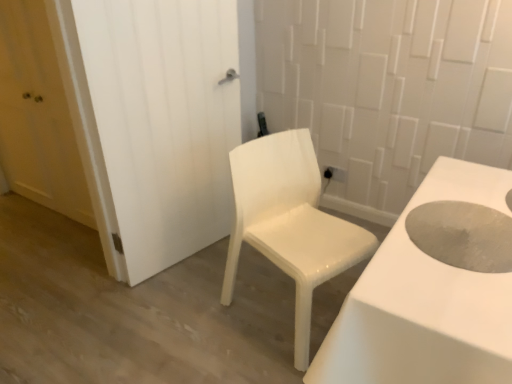
How much space does white matte door at center, marked as the second door in a left-to-right arrangement, occupy horizontally?

3.66 inches.

Image resolution: width=512 pixels, height=384 pixels. Find the location of `white glossy chair at center`. white glossy chair at center is located at coordinates click(289, 222).

Is the position of white glossy chair at center more distant than that of white matte door at center, which is the 1th door from right to left?

No, white glossy chair at center is closer to the camera.

Considering the points (320, 185) and (224, 17), which point is in front, point (320, 185) or point (224, 17)?

The point (224, 17) is closer.

How different are the orientations of white glossy chair at center and white matte door at center, marked as the second door in a left-to-right arrangement, in degrees?

The angular difference between white glossy chair at center and white matte door at center, marked as the second door in a left-to-right arrangement, is 1.38 degrees.

Which of these two, matte white door at left, which ranks as the 1th door in left-to-right order, or white matte door at center, marked as the second door in a left-to-right arrangement, is thinner?

matte white door at left, which ranks as the 1th door in left-to-right order.

Between matte white door at left, which ranks as the 2th door in right-to-left order, and white matte door at center, which is the 1th door from right to left, which one appears on the right side from the viewer's perspective?

white matte door at center, which is the 1th door from right to left.

From the picture: Considering the sizes of matte white door at left, which ranks as the 1th door in left-to-right order, and white matte door at center, which is the 1th door from right to left, in the image, is matte white door at left, which ranks as the 1th door in left-to-right order, taller or shorter than white matte door at center, which is the 1th door from right to left,?

Considering their sizes, matte white door at left, which ranks as the 1th door in left-to-right order, has less height than white matte door at center, which is the 1th door from right to left.

Considering the positions of objects matte white door at left, which ranks as the 1th door in left-to-right order, and white matte door at center, marked as the second door in a left-to-right arrangement, in the image provided, who is in front, matte white door at left, which ranks as the 1th door in left-to-right order, or white matte door at center, marked as the second door in a left-to-right arrangement,?

Positioned in front is white matte door at center, marked as the second door in a left-to-right arrangement.

Is gray matte hole at center right in contact with white matte door at center, which is the 1th door from right to left?

No.

Can you tell me how much gray matte hole at center right and white matte door at center, which is the 1th door from right to left, differ in facing direction?

There is a 164-degree angle between the facing directions of gray matte hole at center right and white matte door at center, which is the 1th door from right to left.

Can we say gray matte hole at center right lies outside white matte door at center, marked as the second door in a left-to-right arrangement?

Yes, gray matte hole at center right is located beyond the bounds of white matte door at center, marked as the second door in a left-to-right arrangement.

Which of these two, gray matte hole at center right or white matte door at center, which is the 1th door from right to left, stands shorter?

gray matte hole at center right.

Is matte white door at left, which ranks as the 2th door in right-to-left order, thinner than white glossy chair at center?

Yes.

Does matte white door at left, which ranks as the 1th door in left-to-right order, have a lesser height compared to white glossy chair at center?

In fact, matte white door at left, which ranks as the 1th door in left-to-right order, may be taller than white glossy chair at center.

Is matte white door at left, which ranks as the 2th door in right-to-left order, placed right next to white glossy chair at center?

matte white door at left, which ranks as the 2th door in right-to-left order, and white glossy chair at center are clearly separated.

From a real-world perspective, which is physically above, matte white door at left, which ranks as the 2th door in right-to-left order, or white glossy chair at center?

matte white door at left, which ranks as the 2th door in right-to-left order, is physically above.

Considering the points (429, 221) and (282, 182), which point is behind, point (429, 221) or point (282, 182)?

Positioned behind is point (282, 182).

Which object is positioned more to the left, gray matte hole at center right or white glossy chair at center?

white glossy chair at center is more to the left.

Between gray matte hole at center right and white glossy chair at center, which one has smaller size?

gray matte hole at center right.

Can you tell me how much gray matte hole at center right and white glossy chair at center differ in facing direction?

The facing directions of gray matte hole at center right and white glossy chair at center are 162 degrees apart.

Can you confirm if white matte door at center, marked as the second door in a left-to-right arrangement, is shorter than white glossy chair at center?

In fact, white matte door at center, marked as the second door in a left-to-right arrangement, may be taller than white glossy chair at center.

Can you confirm if white matte door at center, marked as the second door in a left-to-right arrangement, is wider than white glossy chair at center?

No.

Is white matte door at center, marked as the second door in a left-to-right arrangement, inside or outside of white glossy chair at center?

white matte door at center, marked as the second door in a left-to-right arrangement, lies outside white glossy chair at center.

Does white matte door at center, marked as the second door in a left-to-right arrangement, appear on the right side of white glossy chair at center?

Incorrect, white matte door at center, marked as the second door in a left-to-right arrangement, is not on the right side of white glossy chair at center.

From the image's perspective, is white matte door at center, marked as the second door in a left-to-right arrangement, located above or below matte white door at left, which ranks as the 2th door in right-to-left order?

Clearly, from the image's perspective, white matte door at center, marked as the second door in a left-to-right arrangement, is below matte white door at left, which ranks as the 2th door in right-to-left order.

Is white matte door at center, which is the 1th door from right to left, positioned beyond the bounds of matte white door at left, which ranks as the 2th door in right-to-left order?

Yes, white matte door at center, which is the 1th door from right to left, is located beyond the bounds of matte white door at left, which ranks as the 2th door in right-to-left order.

Considering the relative positions of white matte door at center, marked as the second door in a left-to-right arrangement, and matte white door at left, which ranks as the 2th door in right-to-left order, in the image provided, is white matte door at center, marked as the second door in a left-to-right arrangement, to the left or to the right of matte white door at left, which ranks as the 2th door in right-to-left order,?

Clearly, white matte door at center, marked as the second door in a left-to-right arrangement, is on the right of matte white door at left, which ranks as the 2th door in right-to-left order, in the image.

Where is `chair on the right of white matte door at center, which is the 1th door from right to left`? This screenshot has height=384, width=512. chair on the right of white matte door at center, which is the 1th door from right to left is located at coordinates (289, 222).

At what (x,y) coordinates should I click in order to perform the action: click on door that appears above the white matte door at center, marked as the second door in a left-to-right arrangement (from the image's perspective). Please return your answer as a coordinate pair (x, y). Looking at the image, I should click on (37, 115).

When comparing their distances from matte white door at left, which ranks as the 1th door in left-to-right order, does white matte door at center, which is the 1th door from right to left, or gray matte hole at center right seem closer?

white matte door at center, which is the 1th door from right to left, is closer to matte white door at left, which ranks as the 1th door in left-to-right order.

Based on their spatial positions, is white glossy chair at center or gray matte hole at center right closer to white matte door at center, which is the 1th door from right to left?

white glossy chair at center.

When comparing their distances from matte white door at left, which ranks as the 2th door in right-to-left order, does white glossy chair at center or white matte door at center, marked as the second door in a left-to-right arrangement, seem closer?

white matte door at center, marked as the second door in a left-to-right arrangement, is closer to matte white door at left, which ranks as the 2th door in right-to-left order.

From the image, which object appears to be farther from gray matte hole at center right, white glossy chair at center or matte white door at left, which ranks as the 1th door in left-to-right order?

The object further to gray matte hole at center right is matte white door at left, which ranks as the 1th door in left-to-right order.

Estimate the real-world distances between objects in this image. Which object is further from white matte door at center, marked as the second door in a left-to-right arrangement, matte white door at left, which ranks as the 1th door in left-to-right order, or white glossy chair at center?

matte white door at left, which ranks as the 1th door in left-to-right order, is positioned further to the anchor white matte door at center, marked as the second door in a left-to-right arrangement.

From the image, which object appears to be nearer to white matte door at center, marked as the second door in a left-to-right arrangement, matte white door at left, which ranks as the 1th door in left-to-right order, or gray matte hole at center right?

Among the two, matte white door at left, which ranks as the 1th door in left-to-right order, is located nearer to white matte door at center, marked as the second door in a left-to-right arrangement.

When comparing their distances from white glossy chair at center, does white matte door at center, which is the 1th door from right to left, or gray matte hole at center right seem further?

Based on the image, gray matte hole at center right appears to be further to white glossy chair at center.

Considering their positions, is white matte door at center, marked as the second door in a left-to-right arrangement, positioned closer to matte white door at left, which ranks as the 1th door in left-to-right order, than white glossy chair at center?

The object closer to matte white door at left, which ranks as the 1th door in left-to-right order, is white matte door at center, marked as the second door in a left-to-right arrangement.

This screenshot has height=384, width=512. Find the location of `door located between matte white door at left, which ranks as the 1th door in left-to-right order, and gray matte hole at center right in the left-right direction`. door located between matte white door at left, which ranks as the 1th door in left-to-right order, and gray matte hole at center right in the left-right direction is located at coordinates (163, 121).

This screenshot has width=512, height=384. Identify the location of chair between matte white door at left, which ranks as the 2th door in right-to-left order, and gray matte hole at center right, in the horizontal direction. (289, 222).

Locate an element on the screen. The height and width of the screenshot is (384, 512). door between matte white door at left, which ranks as the 2th door in right-to-left order, and white glossy chair at center from left to right is located at coordinates (163, 121).

The image size is (512, 384). Identify the location of chair located between white matte door at center, marked as the second door in a left-to-right arrangement, and gray matte hole at center right in the left-right direction. (289, 222).